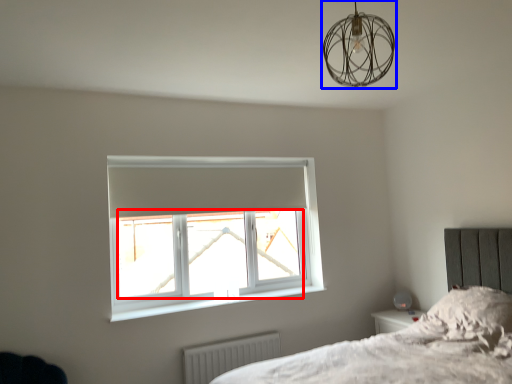
Question: Which point is further to the camera, window screen (highlighted by a red box) or lamp (highlighted by a blue box)?

Choices:
 (A) window screen
 (B) lamp

Answer: (A)